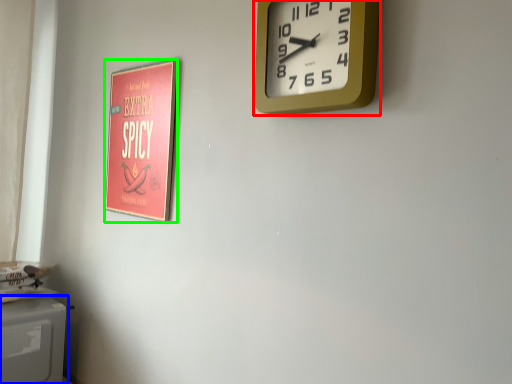
Question: Which object is the closest to the wall clock (highlighted by a red box)? Choose among these: appliance (highlighted by a blue box) or poster page (highlighted by a green box).

Choices:
 (A) appliance
 (B) poster page

Answer: (B)